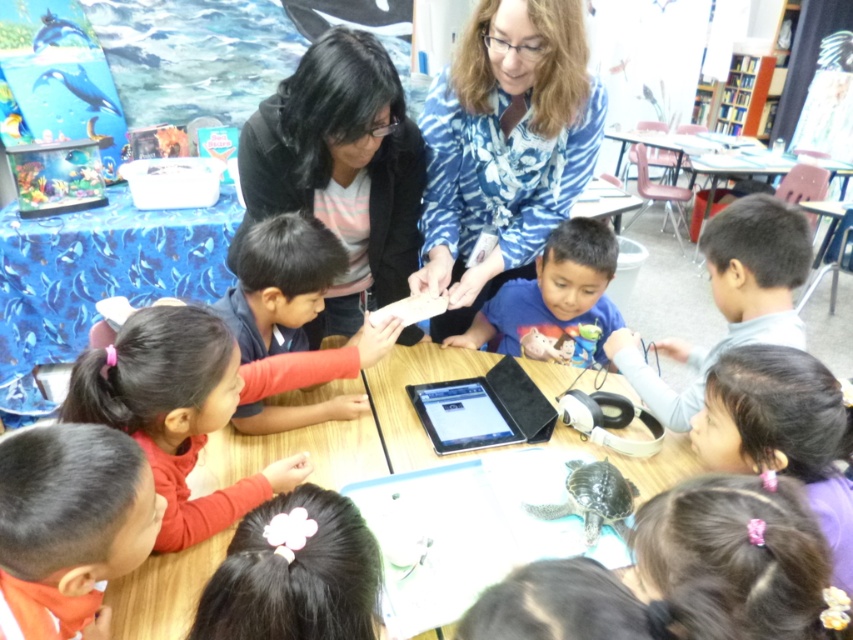
You are a student sitting at the back of the classroom. You notice two items on the table. Which one is shorter, the dark brown hair at lower right or the red matte shirt at center?

The dark brown hair at lower right is shorter than the red matte shirt at center.

You are standing in the classroom looking at the wooden table. Where is the dark brown hair at lower right positioned relative to the table?

The dark brown hair at lower right is located at point 0.873 on the x and 0.869 on the y coordinates relative to the table.